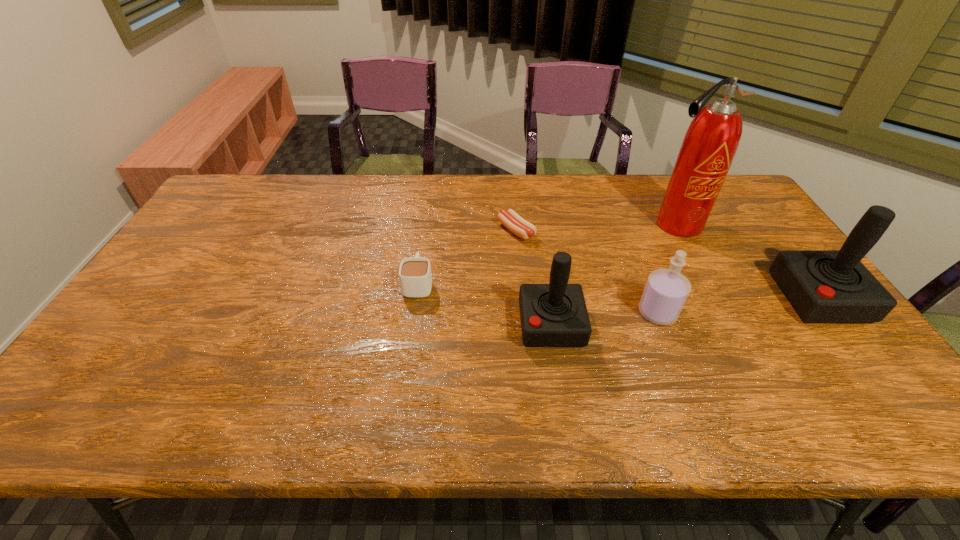
This screenshot has height=540, width=960. Find the location of `the shorter joystick`. the shorter joystick is located at coordinates (552, 315).

Identify the location of the rightmost object. (823, 286).

This screenshot has width=960, height=540. Find the location of `the right joystick`. the right joystick is located at coordinates (823, 286).

Identify the location of fire extinguisher. The image size is (960, 540). (711, 141).

Identify the location of the second object from right to left. (711, 141).

Where is `sausage`? The image size is (960, 540). sausage is located at coordinates (510, 219).

Where is `the second shortest object`? the second shortest object is located at coordinates (415, 276).

At what (x,y) coordinates should I click in order to perform the action: click on the leftmost object. Please return your answer as a coordinate pair (x, y). This screenshot has height=540, width=960. Looking at the image, I should click on (415, 276).

What are the coordinates of `perfume` in the screenshot? It's located at (666, 290).

Where is `vacant space located 0.130m on the base of the shorter joystick`? vacant space located 0.130m on the base of the shorter joystick is located at coordinates (469, 325).